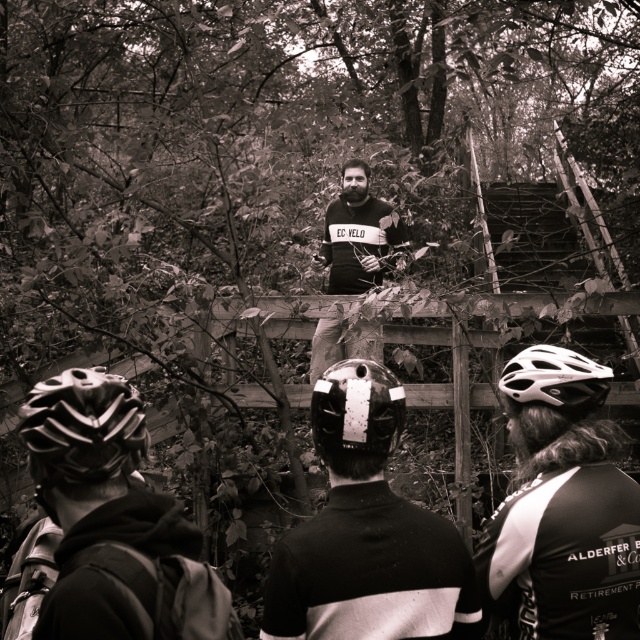
You are a photographer trying to capture both the white matte helmet at upper center and the shiny black helmet at lower left in a single shot. Which helmet would appear closer to the camera in your photo?

The white matte helmet at upper center appears closer to the camera because it is further to the viewer than the shiny black helmet at lower left.

You are standing in the scene and want to place a small marker at the two points mentioned. Which point is closer to you, point [576,456] or point [61,480]?

Point [576,456] is closer to you because it is further to the camera than point [61,480].

You are a photographer trying to capture a clear shot of the white matte bicycle helmet at center. However, the dark gray sweater at center is blocking your view. Can you adjust your position to see the helmet without moving the objects?

The white matte bicycle helmet at center is behind the dark gray sweater at center, so moving your position slightly forward or to the side might allow you to see around or over the sweater to capture the helmet.